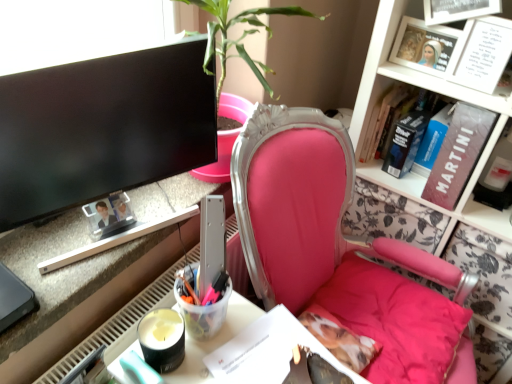
Question: Would you say hardcover book at upper right, acting as the 5th book starting from the front, is a long distance from hardcover book at upper right, placed as the 2th book when sorted from back to front?

Choices:
 (A) no
 (B) yes

Answer: (A)

Question: Can you confirm if hardcover book at upper right, which is the 1th book from back to front, is positioned to the right of hardcover book at upper right, placed as the 2th book when sorted from back to front?

Choices:
 (A) no
 (B) yes

Answer: (A)

Question: Could you tell me if hardcover book at upper right, acting as the 5th book starting from the front, is turned towards hardcover book at upper right, which ranks as the 4th book in front-to-back order?

Choices:
 (A) no
 (B) yes

Answer: (A)

Question: Is hardcover book at upper right, which is the 1th book from back to front, completely or partially outside of hardcover book at upper right, placed as the 2th book when sorted from back to front?

Choices:
 (A) yes
 (B) no

Answer: (A)

Question: Considering the relative sizes of hardcover book at upper right, acting as the 5th book starting from the front, and hardcover book at upper right, which ranks as the 4th book in front-to-back order, in the image provided, is hardcover book at upper right, acting as the 5th book starting from the front, thinner than hardcover book at upper right, which ranks as the 4th book in front-to-back order,?

Choices:
 (A) yes
 (B) no

Answer: (A)

Question: Is metallic silver desk at lower left bigger or smaller than pink fabric chair at center?

Choices:
 (A) big
 (B) small

Answer: (B)

Question: Does point [89, 314] appear closer or farther from the camera than point [286, 256]?

Choices:
 (A) farther
 (B) closer

Answer: (B)

Question: From a real-world perspective, is metallic silver desk at lower left positioned above or below pink fabric chair at center?

Choices:
 (A) below
 (B) above

Answer: (B)

Question: Looking at their shapes, would you say metallic silver desk at lower left is wider or thinner than pink fabric chair at center?

Choices:
 (A) thin
 (B) wide

Answer: (A)

Question: Visually, is black glossy monitor at upper left positioned to the left or to the right of blue hardcover book at upper right, which is the 3th book in back-to-front order?

Choices:
 (A) left
 (B) right

Answer: (A)

Question: From a real-world perspective, is black glossy monitor at upper left positioned above or below blue hardcover book at upper right, acting as the third book starting from the front?

Choices:
 (A) above
 (B) below

Answer: (A)

Question: From the image's perspective, is black glossy monitor at upper left located above or below blue hardcover book at upper right, which is the 3th book in back-to-front order?

Choices:
 (A) above
 (B) below

Answer: (B)

Question: From their relative heights in the image, would you say black glossy monitor at upper left is taller or shorter than blue hardcover book at upper right, which is the 3th book in back-to-front order?

Choices:
 (A) short
 (B) tall

Answer: (B)

Question: In the image, is hardcover book at upper right, which ranks as the 4th book in front-to-back order, positioned in front of or behind white paper at upper right, arranged as the first book when viewed from the front?

Choices:
 (A) behind
 (B) front

Answer: (A)

Question: Is hardcover book at upper right, which ranks as the 4th book in front-to-back order, inside the boundaries of white paper at upper right, acting as the fifth book starting from the back, or outside?

Choices:
 (A) outside
 (B) inside

Answer: (A)